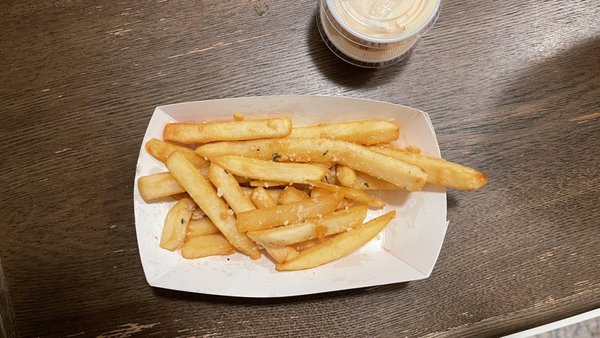
Where is `floor`? floor is located at coordinates (579, 331).